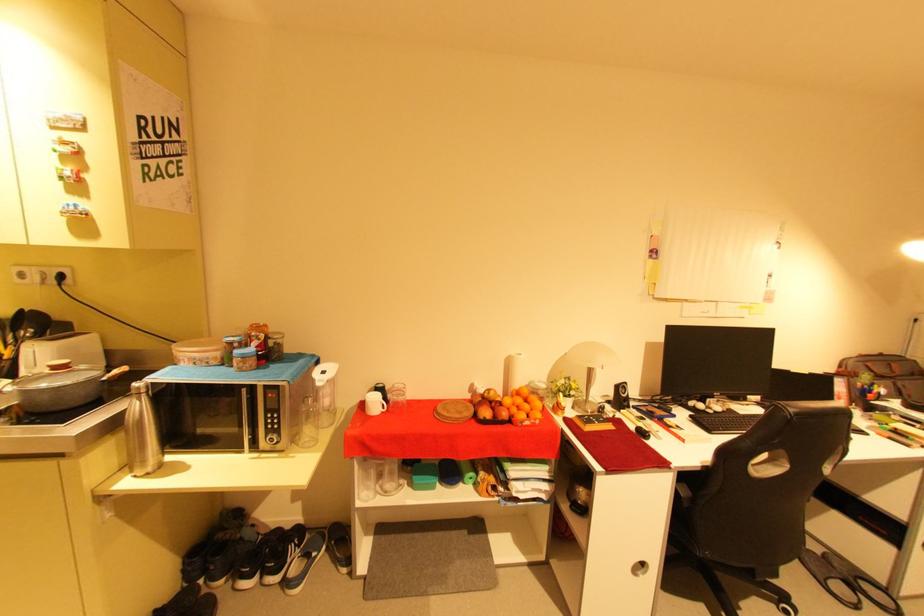
Describe the element at coordinates (141, 432) in the screenshot. I see `a water pitcher handle` at that location.